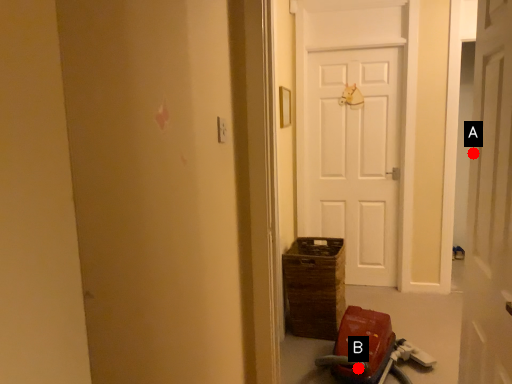
Question: Two points are circled on the image, labeled by A and B beside each circle. Which point is further to the camera?

Choices:
 (A) A is further
 (B) B is further

Answer: (B)